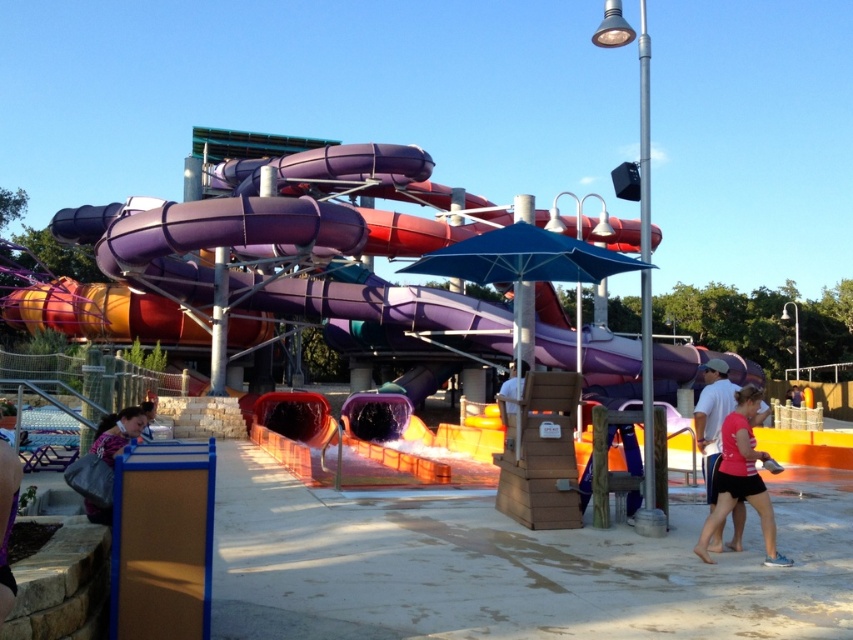
You are a lifeguard at the water park and need to retrieve both the pink fabric shirt at lower right and the floral fabric bag at lower left. If you start at the seating area, which item should you go to first to minimize the total distance walked?

To minimize the total distance walked, you should go to the item closer to the starting point first. However, since the distance between the pink fabric shirt at lower right and the floral fabric bag at lower left is 4.73 meters, the exact location of the seating area relative to both items is needed to determine the optimal path. Without knowing the seating area position, it is impossible to decide which item is closer.

You are a photographer trying to capture a candid shot of the pink fabric shorts at lower right and the pink fabric shirt at lower right. Since you want to focus on the clothing items, which one should you zoom in on more to ensure it fills the frame appropriately?

The pink fabric shorts at lower right has a larger width than the pink fabric shirt at lower right, so you should zoom in more on the pink fabric shorts at lower right to ensure it fills the frame appropriately.

You are at the water park and see two pink fabric items at the lower right corner. Which one is taller between the pink fabric shorts at lower right and the pink fabric shirt at lower right?

The pink fabric shorts at lower right is much taller than the pink fabric shirt at lower right according to the description.